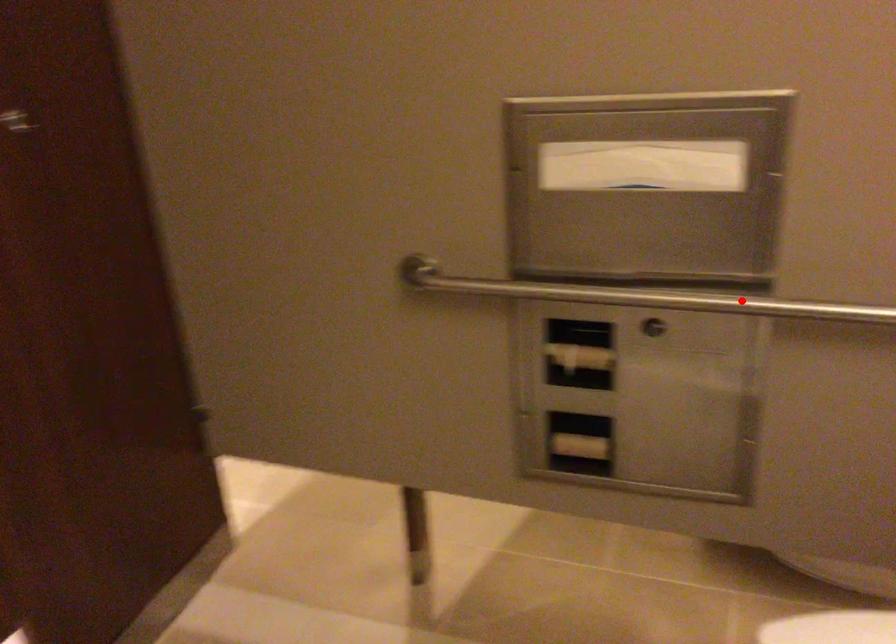
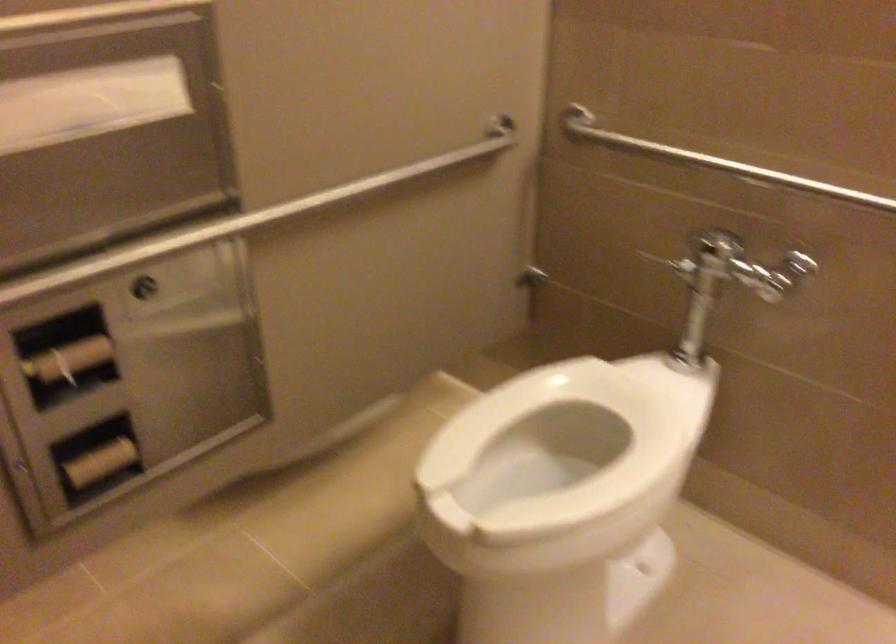
Find the pixel in the second image that matches the highlighted location in the first image.

(246, 220)